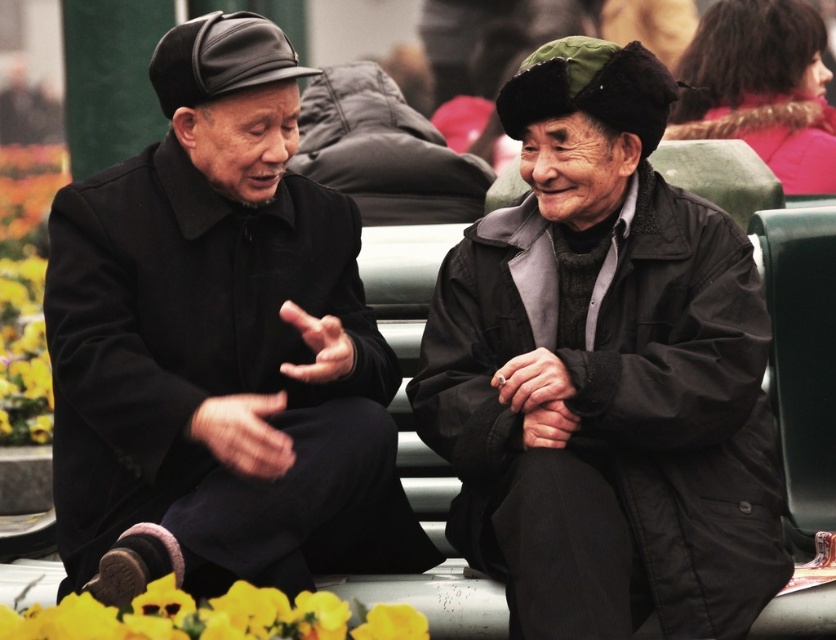
Question: Does matte black coat at left have a larger size compared to yellow fabric flower at lower left?

Choices:
 (A) no
 (B) yes

Answer: (B)

Question: Does dark gray woolen jacket at center appear on the right side of yellow fabric flower at lower left?

Choices:
 (A) yes
 (B) no

Answer: (A)

Question: Which object is closer to the camera taking this photo?

Choices:
 (A) matte black coat at left
 (B) dark gray woolen jacket at center
 (C) yellow fabric flower at lower left

Answer: (B)

Question: Which of the following is the farthest from the observer?

Choices:
 (A) matte black coat at left
 (B) dark gray woolen jacket at center
 (C) yellow fabric flower at lower left
 (D) velvet pink coat at upper right

Answer: (D)

Question: Which object is positioned farthest from the yellow fabric flower at lower left?

Choices:
 (A) dark gray woolen jacket at center
 (B) velvet pink coat at upper right
 (C) matte black coat at left

Answer: (B)

Question: Is dark gray woolen jacket at center positioned in front of velvet pink coat at upper right?

Choices:
 (A) no
 (B) yes

Answer: (B)